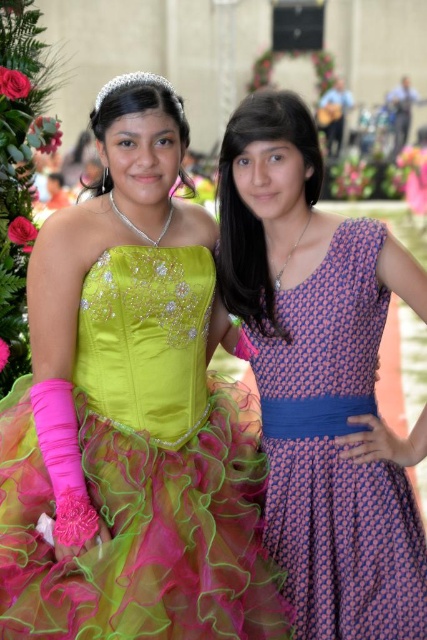
Is neon satin dress at left positioned at the back of purple printed fabric dress at right?

No, neon satin dress at left is in front of purple printed fabric dress at right.

Locate an element on the screen. neon satin dress at left is located at coordinates (143, 474).

The width and height of the screenshot is (427, 640). Describe the element at coordinates (143, 474) in the screenshot. I see `neon satin dress at left` at that location.

Identify the location of neon satin dress at left. (143, 474).

Can you confirm if purple printed fabric dress at right is positioned to the right of clear crystal tiara at upper center?

Correct, you'll find purple printed fabric dress at right to the right of clear crystal tiara at upper center.

Consider the image. Who is more distant from viewer, (310, 500) or (96, 106)?

Positioned behind is point (96, 106).

The width and height of the screenshot is (427, 640). In order to click on purple printed fabric dress at right in this screenshot , I will do `click(336, 452)`.

Who is positioned more to the left, neon satin dress at left or clear crystal tiara at upper center?

Positioned to the left is clear crystal tiara at upper center.

Which is behind, point (204, 371) or point (134, 76)?

The point (204, 371) is behind.

Where is `neon satin dress at left`? The image size is (427, 640). neon satin dress at left is located at coordinates (143, 474).